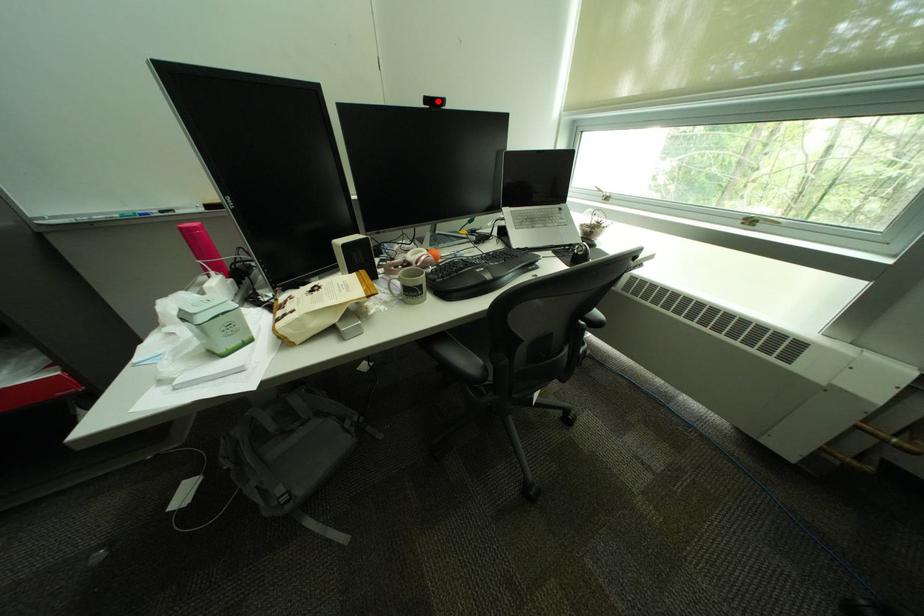
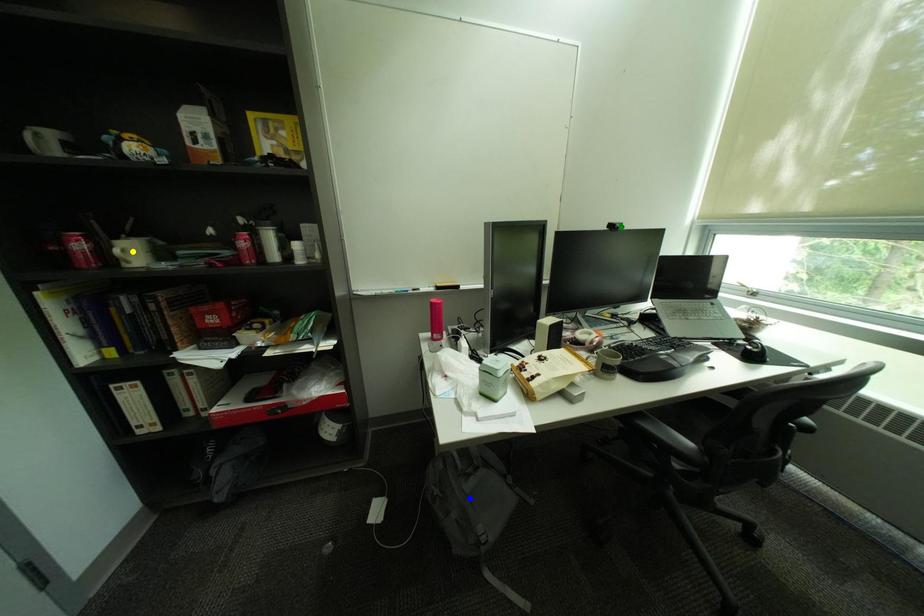
Question: I am providing you with two images of the same scene from different viewpoints. A red point is marked on the first image. You are given multiple points on the second image. Which mark in image 2 goes with the point in image 1?

Choices:
 (A) green point
 (B) yellow point
 (C) blue point

Answer: (A)